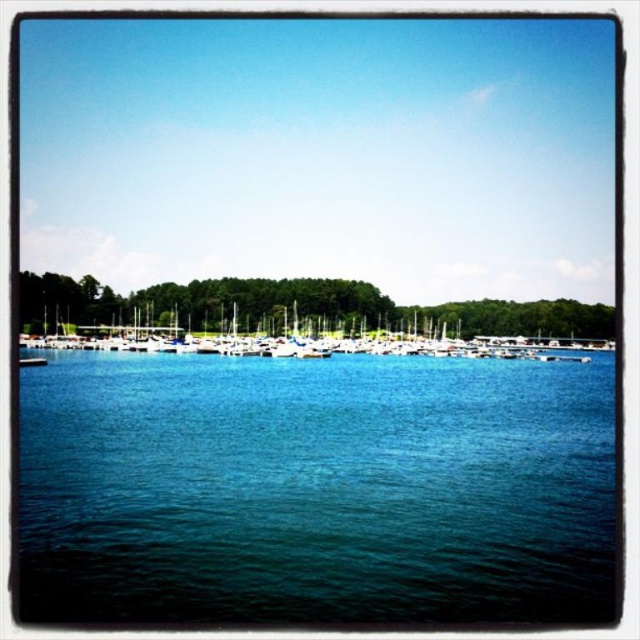
Who is positioned more to the left, blue liquid water at center or white matte boats at center?

blue liquid water at center is more to the left.

Can you confirm if blue liquid water at center is positioned to the right of white matte boats at center?

Incorrect, blue liquid water at center is not on the right side of white matte boats at center.

Does point (344, 403) lie behind point (60, 339)?

No, it is not.

Where is `blue liquid water at center`? The image size is (640, 640). blue liquid water at center is located at coordinates (316, 490).

Who is positioned more to the left, blue liquid water at center or green leafy trees at center?

Positioned to the left is blue liquid water at center.

Between blue liquid water at center and green leafy trees at center, which one is positioned lower?

blue liquid water at center is below.

Image resolution: width=640 pixels, height=640 pixels. Find the location of `blue liquid water at center`. blue liquid water at center is located at coordinates (316, 490).

This screenshot has height=640, width=640. I want to click on blue liquid water at center, so click(x=316, y=490).

Is point (454, 317) closer to viewer compared to point (492, 324)?

Yes.

This screenshot has height=640, width=640. What are the coordinates of `green leafy trees at center` in the screenshot? It's located at (296, 307).